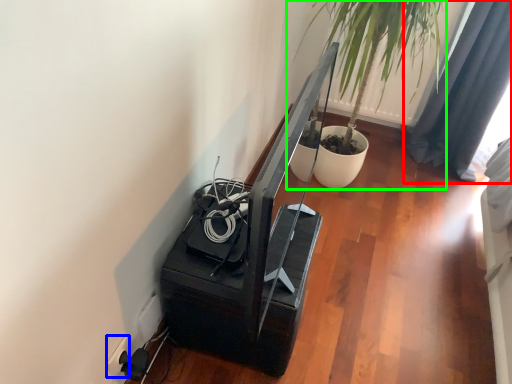
Question: Estimate the real-world distances between objects in this image. Which object is closer to curtain (highlighted by a red box), electric outlet (highlighted by a blue box) or houseplant (highlighted by a green box)?

Choices:
 (A) electric outlet
 (B) houseplant

Answer: (B)